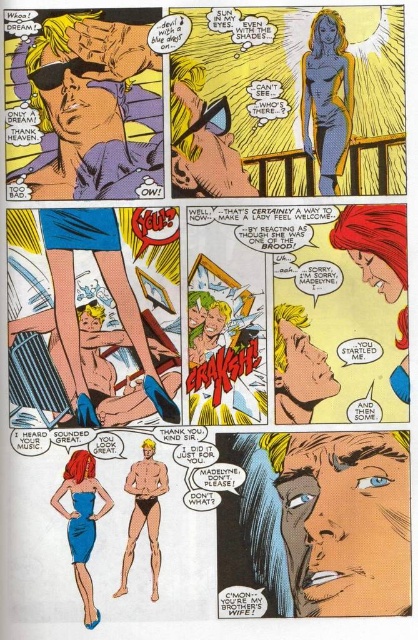
Does smooth blue shorts at lower left appear on the right side of smooth tan skin at lower center?

Incorrect, smooth blue shorts at lower left is not on the right side of smooth tan skin at lower center.

Does smooth blue shorts at lower left appear under smooth tan skin at lower center?

Incorrect, smooth blue shorts at lower left is not positioned below smooth tan skin at lower center.

Image resolution: width=418 pixels, height=640 pixels. Describe the element at coordinates (101, 323) in the screenshot. I see `smooth blue shorts at lower left` at that location.

Locate an element on the screen. The width and height of the screenshot is (418, 640). smooth blue shorts at lower left is located at coordinates (101, 323).

Is matte black sunglasses at upper left to the left of blue satin dress at lower left from the viewer's perspective?

No, matte black sunglasses at upper left is not to the left of blue satin dress at lower left.

Who is taller, matte black sunglasses at upper left or blue satin dress at lower left?

With more height is matte black sunglasses at upper left.

Where is `matte black sunglasses at upper left`? matte black sunglasses at upper left is located at coordinates (94, 109).

Who is taller, smooth skin face at center or blue satin dress at lower left?

With more height is smooth skin face at center.

Does point (295, 467) come farther from viewer compared to point (97, 492)?

Yes, it is.

Locate an element on the screen. Image resolution: width=418 pixels, height=640 pixels. smooth skin face at center is located at coordinates (344, 520).